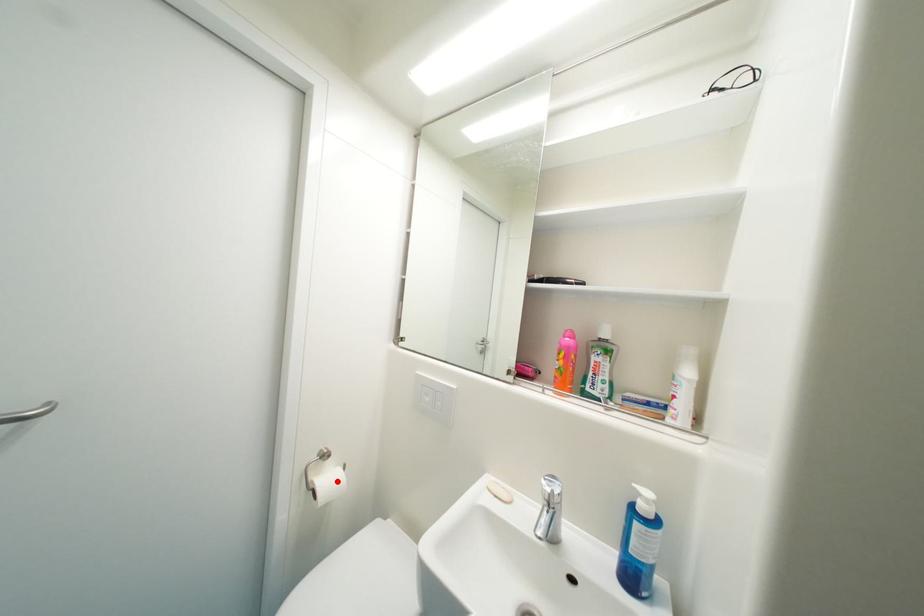
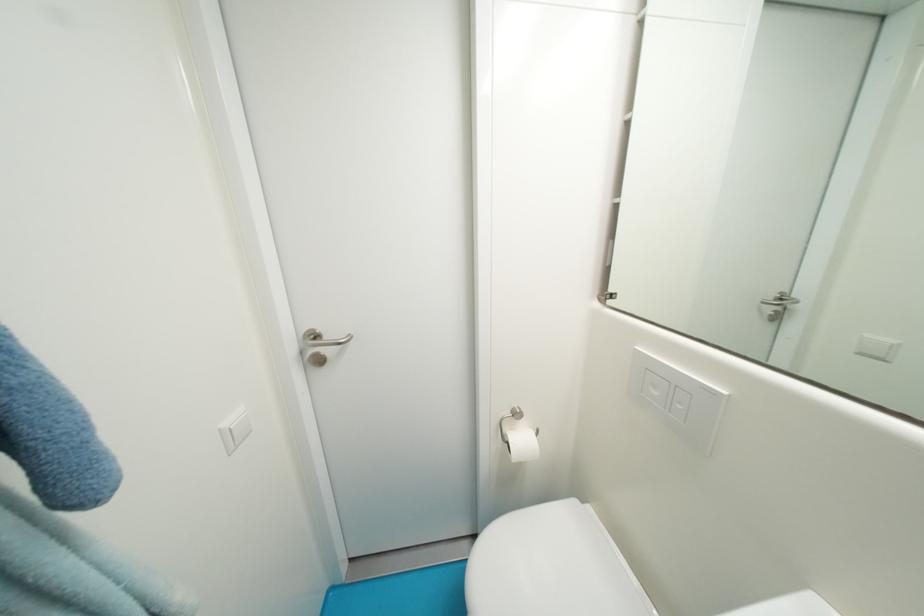
Locate, in the second image, the point that corresponds to the highlighted location in the first image.

(529, 442)